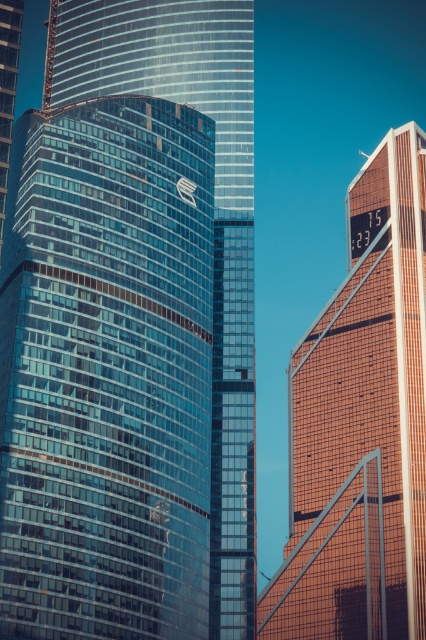
Question: Can you confirm if glassy blue skyscraper at center is bigger than orange glass skyscraper at right?

Choices:
 (A) yes
 (B) no

Answer: (B)

Question: Which point is closer to the camera taking this photo?

Choices:
 (A) (363, 326)
 (B) (17, 294)

Answer: (B)

Question: Which point is closer to the camera?

Choices:
 (A) glassy blue skyscraper at center
 (B) orange glass skyscraper at right

Answer: (A)

Question: Can you confirm if glassy blue skyscraper at center is thinner than orange glass skyscraper at right?

Choices:
 (A) yes
 (B) no

Answer: (A)

Question: Does glassy blue skyscraper at center appear under orange glass skyscraper at right?

Choices:
 (A) yes
 (B) no

Answer: (B)

Question: Which of the following is the farthest from the observer?

Choices:
 (A) (189, 480)
 (B) (405, 353)

Answer: (B)